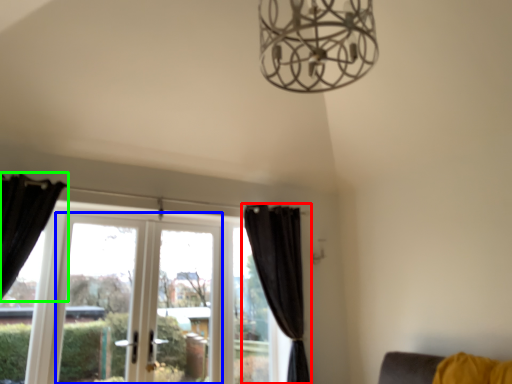
Question: Which object is positioned closest to curtain (highlighted by a red box)? Select from screen door (highlighted by a blue box) and curtain (highlighted by a green box).

Choices:
 (A) screen door
 (B) curtain

Answer: (A)